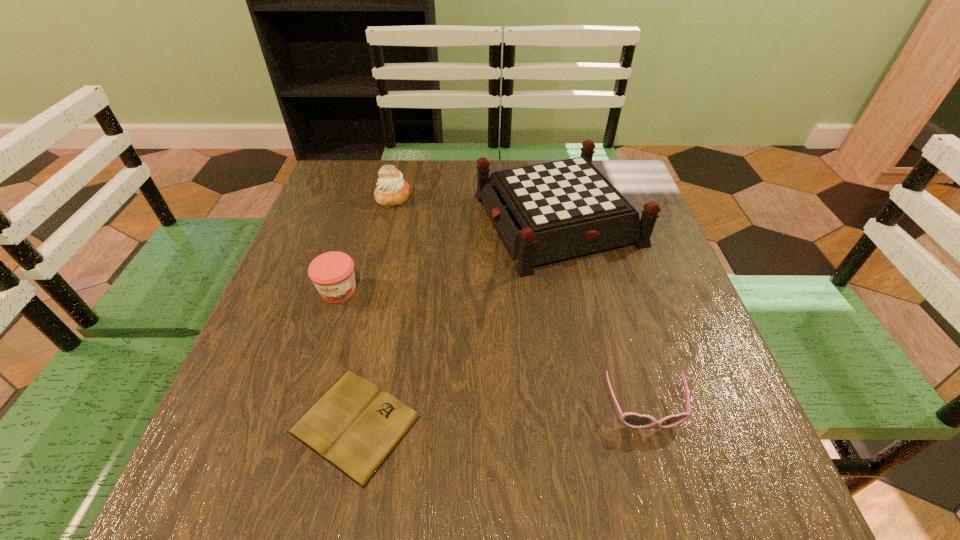
The height and width of the screenshot is (540, 960). What are the coordinates of `free space that is in between the third shortest object and the tallest object` in the screenshot? It's located at (447, 255).

The height and width of the screenshot is (540, 960). Find the location of `vacant region between the pastry and the jam`. vacant region between the pastry and the jam is located at coordinates (366, 244).

The image size is (960, 540). In order to click on free space that is in between the shortest object and the jam in this screenshot , I will do coord(347,357).

Locate an element on the screen. free spot between the book and the second shortest object is located at coordinates (500, 416).

I want to click on unoccupied area between the checkerboard and the third shortest object, so click(447, 255).

Locate an element on the screen. This screenshot has height=540, width=960. free point between the tallest object and the pastry is located at coordinates (475, 208).

You are a GUI agent. You are given a task and a screenshot of the screen. Output one action in this format:
    pyautogui.click(x=<x>, y=<y>)
    Task: Click on the free spot between the sunglasses and the checkerboard
    The image size is (960, 540).
    Given the screenshot: What is the action you would take?
    pyautogui.click(x=601, y=314)

At what (x,y) coordinates should I click in order to perform the action: click on the second closest object relative to the checkerboard. Please return your answer as a coordinate pair (x, y). The width and height of the screenshot is (960, 540). Looking at the image, I should click on (332, 273).

Locate which object ranks fourth in proximity to the pastry. Please provide its 2D coordinates. Your answer should be formatted as a tuple, i.e. [(x, y)], where the tuple contains the x and y coordinates of a point satisfying the conditions above.

[(631, 419)]

Image resolution: width=960 pixels, height=540 pixels. Find the location of `vacant space that satisfies the following two spatial constraints: 1. on the front label of the book; 2. on the right side of the jam`. vacant space that satisfies the following two spatial constraints: 1. on the front label of the book; 2. on the right side of the jam is located at coordinates (297, 423).